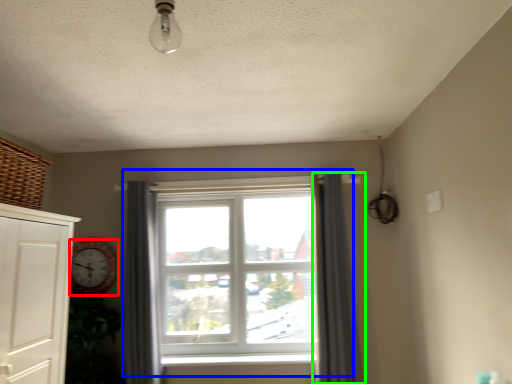
Question: Which object is the closest to the clock (highlighted by a red box)? Choose among these: window (highlighted by a blue box) or curtain (highlighted by a green box).

Choices:
 (A) window
 (B) curtain

Answer: (A)